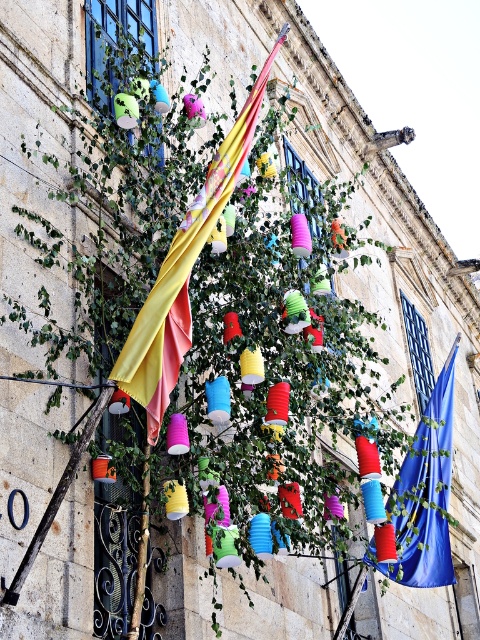
Question: Among these points, which one is nearest to the camera?

Choices:
 (A) (440, 577)
 (B) (263, 67)

Answer: (B)

Question: Can you confirm if yellow fabric flag at center is smaller than blue fabric flag at center?

Choices:
 (A) no
 (B) yes

Answer: (B)

Question: Does yellow fabric flag at center have a lesser width compared to blue fabric flag at center?

Choices:
 (A) no
 (B) yes

Answer: (B)

Question: Is yellow fabric flag at center to the left of blue fabric flag at center from the viewer's perspective?

Choices:
 (A) no
 (B) yes

Answer: (B)